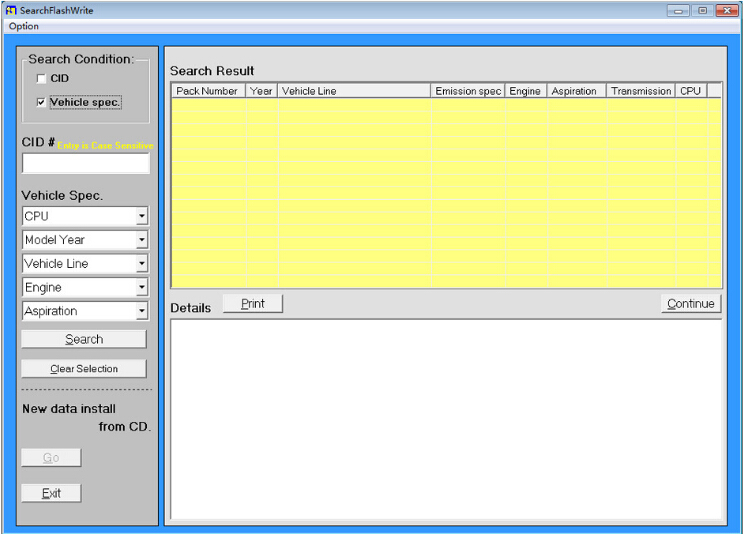
The height and width of the screenshot is (534, 743). I want to click on exit button, so click(48, 493).